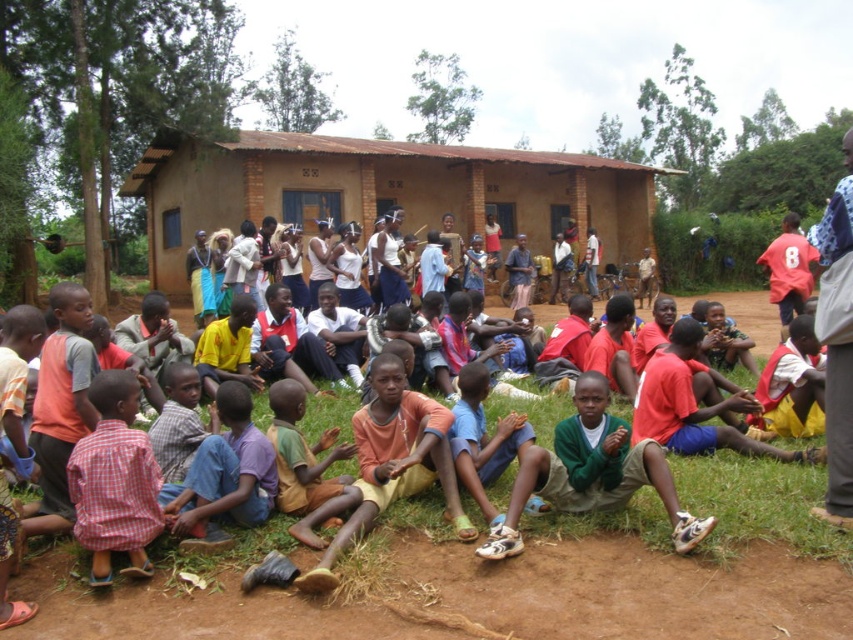
Between brown clay hut at center and yellow cotton shirt at center, which one has more height?

With more height is brown clay hut at center.

What do you see at coordinates (380, 189) in the screenshot? Image resolution: width=853 pixels, height=640 pixels. I see `brown clay hut at center` at bounding box center [380, 189].

Image resolution: width=853 pixels, height=640 pixels. Describe the element at coordinates (380, 189) in the screenshot. I see `brown clay hut at center` at that location.

The width and height of the screenshot is (853, 640). Find the location of `brown clay hut at center`. brown clay hut at center is located at coordinates (380, 189).

Does brown clay hut at center appear under light blue fabric pants at lower center?

No.

Does brown clay hut at center have a greater height compared to light blue fabric pants at lower center?

Indeed, brown clay hut at center has a greater height compared to light blue fabric pants at lower center.

Who is more forward, [679,172] or [448,435]?

Point [448,435] is more forward.

What are the coordinates of `brown clay hut at center` in the screenshot? It's located at (380, 189).

Does point (343, 483) come behind point (479, 369)?

No, it is in front of (479, 369).

Does yellow cotton shirt at center appear under light blue fabric pants at lower center?

Indeed, yellow cotton shirt at center is positioned under light blue fabric pants at lower center.

The width and height of the screenshot is (853, 640). In order to click on yellow cotton shirt at center in this screenshot , I will do `click(306, 467)`.